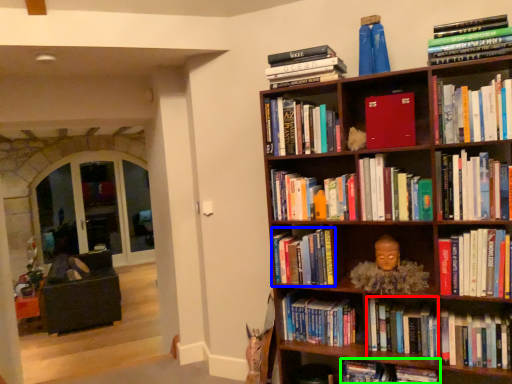
Question: Estimate the real-world distances between objects in this image. Which object is closer to book (highlighted by a red box), book (highlighted by a blue box) or book (highlighted by a green box)?

Choices:
 (A) book
 (B) book

Answer: (B)